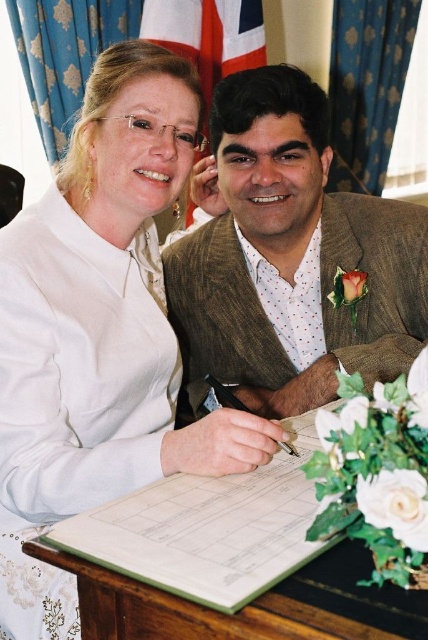
Can you confirm if white matte shirt at upper left is bigger than brown textured suit at center?

Indeed, white matte shirt at upper left has a larger size compared to brown textured suit at center.

Which of these two, white matte shirt at upper left or brown textured suit at center, stands shorter?

brown textured suit at center is shorter.

Does point (104, 397) come behind point (291, 148)?

No, it is in front of (291, 148).

Where is `white matte shirt at upper left`? white matte shirt at upper left is located at coordinates (98, 332).

Find the location of a particular element. The width and height of the screenshot is (428, 640). white matte shirt at upper left is located at coordinates (98, 332).

Consider the image. Can you confirm if white matte shirt at upper left is smaller than wooden table at center?

Incorrect, white matte shirt at upper left is not smaller in size than wooden table at center.

Is point (106, 307) closer to camera compared to point (382, 627)?

That is False.

Find the location of a particular element. The height and width of the screenshot is (640, 428). white matte shirt at upper left is located at coordinates (98, 332).

Consider the image. Is brown textured suit at center bigger than wooden table at center?

Correct, brown textured suit at center is larger in size than wooden table at center.

Who is shorter, brown textured suit at center or wooden table at center?

Standing shorter between the two is wooden table at center.

Where is `brown textured suit at center`? This screenshot has height=640, width=428. brown textured suit at center is located at coordinates (293, 259).